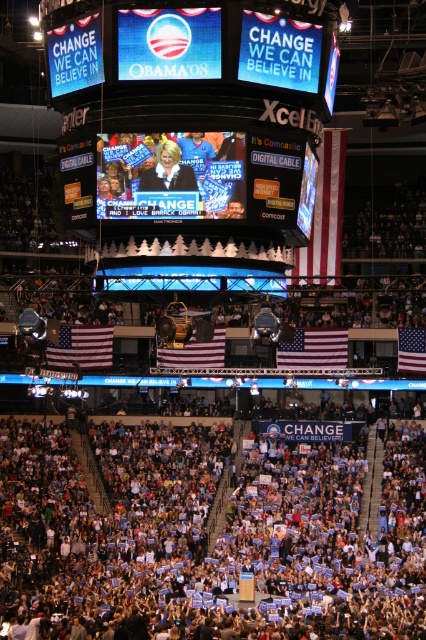
Measure the distance from matte digital cable sign at center to white cotton flag at center.

matte digital cable sign at center is 135.42 feet away from white cotton flag at center.

Is matte digital cable sign at center above white cotton flag at center?

Yes, matte digital cable sign at center is above white cotton flag at center.

Find the location of `matte digital cable sign at center`. matte digital cable sign at center is located at coordinates (195, 179).

Does american flag at lower left have a greater width compared to red fabric flag at right?

No.

Is point (97, 348) closer to viewer compared to point (408, 353)?

No, (97, 348) is further to viewer.

You are a GUI agent. You are given a task and a screenshot of the screen. Output one action in this format:
    pyautogui.click(x=<x>, y=<y>)
    Task: Click on the american flag at lower left
    This screenshot has width=426, height=640.
    Given the screenshot: What is the action you would take?
    80,348

Between blue fabric crowd at lower center and american flag at center, which one appears on the right side from the viewer's perspective?

Positioned to the right is blue fabric crowd at lower center.

Can you confirm if blue fabric crowd at lower center is thinner than american flag at center?

Incorrect, blue fabric crowd at lower center's width is not less than american flag at center's.

Measure the distance between point (x=253, y=508) and camera.

Point (x=253, y=508) is 111.00 meters away from camera.

Where is `blue fabric crowd at lower center`? This screenshot has width=426, height=640. blue fabric crowd at lower center is located at coordinates (204, 540).